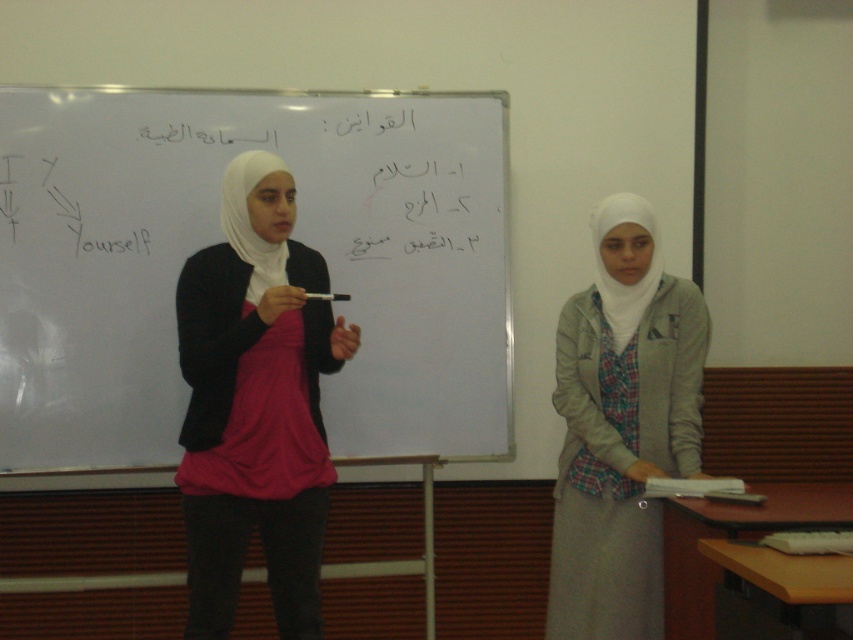
You are a student sitting in the classroom and want to see both the white matte whiteboard at center and the light gray fabric hijab at right clearly. Which one do you need to move closer to in order to see better?

The light gray fabric hijab at right is further away from you than the white matte whiteboard at center. To see it better, you need to move closer to it.

You are a student trying to write on the whiteboard but are standing in front of the whiteboard. Which object is wider, the white matte whiteboard at center or the matte pink blouse at center?

The white matte whiteboard at center is wider than the matte pink blouse at center.

You are a student trying to take notes from the white matte whiteboard at center during a presentation. If you are standing at position point 0.375, 0.260, can you easily reach the whiteboard to write on it?

The white matte whiteboard at center is located at point (221, 240), so yes, you can easily reach it to write on it since you are standing at that position.